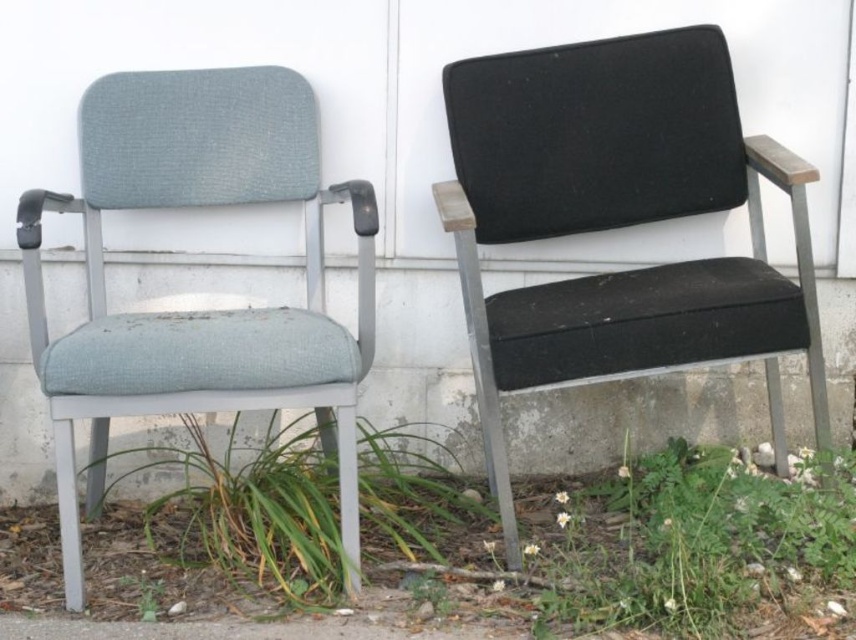
You are standing in front of the two chairs and want to move to the green leafy grass at lower center. Which direction should you move relative to the matte gray fabric chair at left?

The matte gray fabric chair at left is to the left of the green leafy grass at lower center, so you should move to the right of the matte gray fabric chair at left to reach the green leafy grass at lower center.

You are standing in front of the two chairs and want to place a small decoration between them. The decoration must be placed exactly halfway between point A at point (703,152) and point B at point (280,122). Which point is closer to the decoration when viewed from your perspective?

Point A at point (703,152) is closer to the camera than point B at point (280,122), so the decoration placed halfway between them will be closer to point A.

You are standing in front of the two chairs and want to place a small potted plant between the matte gray fabric chair at left and the green leafy grass at lower center. Which object should the plant be closer to if you want it to be near the foreground of the image?

The plant should be placed closer to the matte gray fabric chair at left because it is closer to the viewer than the green leafy grass at lower center, so positioning the plant near the chair would keep it in the foreground.